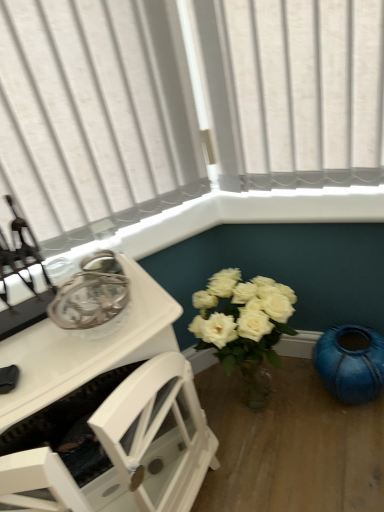
The image size is (384, 512). What are the coordinates of `teal glossy vase at lower right` in the screenshot? It's located at (351, 362).

Measure the distance between teal glossy vase at lower right and camera.

teal glossy vase at lower right and camera are 1.21 meters apart from each other.

What do you see at coordinates (351, 362) in the screenshot? I see `teal glossy vase at lower right` at bounding box center [351, 362].

What do you see at coordinates (87, 347) in the screenshot?
I see `white glossy table at upper left` at bounding box center [87, 347].

What are the coordinates of `white glossy table at upper left` in the screenshot? It's located at (87, 347).

Where is `teal glossy vase at lower right`? teal glossy vase at lower right is located at coordinates (351, 362).

Which is more to the right, teal glossy vase at lower right or white glossy table at upper left?

From the viewer's perspective, teal glossy vase at lower right appears more on the right side.

Relative to white glossy table at upper left, is teal glossy vase at lower right in front or behind?

teal glossy vase at lower right is behind white glossy table at upper left.

Does point (361, 354) appear closer or farther from the camera than point (145, 303)?

Point (361, 354).

From the image's perspective, between teal glossy vase at lower right and white glossy table at upper left, which one is located above?

white glossy table at upper left.

From a real-world perspective, is teal glossy vase at lower right above or below white glossy table at upper left?

teal glossy vase at lower right is below white glossy table at upper left.

Which object is thinner, teal glossy vase at lower right or white glossy table at upper left?

With smaller width is teal glossy vase at lower right.

Between teal glossy vase at lower right and white glossy table at upper left, which one has less height?

white glossy table at upper left is shorter.

Considering the relative sizes of teal glossy vase at lower right and white glossy table at upper left in the image provided, is teal glossy vase at lower right bigger than white glossy table at upper left?

Correct, teal glossy vase at lower right is larger in size than white glossy table at upper left.

Would you say teal glossy vase at lower right contains white glossy table at upper left?

Result: No, white glossy table at upper left is located outside of teal glossy vase at lower right.

Is teal glossy vase at lower right not near white glossy table at upper left?

They are positioned close to each other.

Does teal glossy vase at lower right turn towards white glossy table at upper left?

No.

How many degrees apart are the facing directions of teal glossy vase at lower right and white glossy table at upper left?

49.5 degrees.

Looking at this image, how far apart are teal glossy vase at lower right and white glossy table at upper left?

The distance of teal glossy vase at lower right from white glossy table at upper left is 25.91 inches.

In the image, there is a white glossy table at upper left. At what (x,y) coordinates should I click in order to perform the action: click on teal below it (from a real-world perspective). Please return your answer as a coordinate pair (x, y). The image size is (384, 512). Looking at the image, I should click on (351, 362).

Is white glossy table at upper left to the left or to the right of teal glossy vase at lower right in the image?

From the image, it's evident that white glossy table at upper left is to the left of teal glossy vase at lower right.

Which object is further away from the camera taking this photo, white glossy table at upper left or teal glossy vase at lower right?

teal glossy vase at lower right is further away from the camera.

Which is in front, point (31, 332) or point (350, 367)?

The point (31, 332) is closer.

From the image's perspective, does white glossy table at upper left appear lower than teal glossy vase at lower right?

Incorrect, from the image's perspective, white glossy table at upper left is higher than teal glossy vase at lower right.

From a real-world perspective, is white glossy table at upper left located higher than teal glossy vase at lower right?

Indeed, from a real-world perspective, white glossy table at upper left stands above teal glossy vase at lower right.

Does white glossy table at upper left have a lesser width compared to teal glossy vase at lower right?

No.

Can you confirm if white glossy table at upper left is shorter than teal glossy vase at lower right?

Indeed, white glossy table at upper left has a lesser height compared to teal glossy vase at lower right.

Considering the relative sizes of white glossy table at upper left and teal glossy vase at lower right in the image provided, is white glossy table at upper left bigger than teal glossy vase at lower right?

No, white glossy table at upper left is not bigger than teal glossy vase at lower right.

Would you say white glossy table at upper left contains teal glossy vase at lower right?

No.

Is white glossy table at upper left beside teal glossy vase at lower right?

No, white glossy table at upper left is not touching teal glossy vase at lower right.

Consider the image. Is white glossy table at upper left aimed at teal glossy vase at lower right?

No, white glossy table at upper left is not aimed at teal glossy vase at lower right.

How far apart are white glossy table at upper left and teal glossy vase at lower right?

65.82 centimeters.

In the image, there is a white glossy table at upper left. Identify the location of teal below it (from a real-world perspective). The image size is (384, 512). pos(351,362).

You are a GUI agent. You are given a task and a screenshot of the screen. Output one action in this format:
    pyautogui.click(x=<x>, y=<y>)
    Task: Click on the teal behind the white glossy table at upper left
    The width and height of the screenshot is (384, 512).
    Given the screenshot: What is the action you would take?
    pyautogui.click(x=351, y=362)

You are a GUI agent. You are given a task and a screenshot of the screen. Output one action in this format:
    pyautogui.click(x=<x>, y=<y>)
    Task: Click on the table above the teal glossy vase at lower right (from the image's perspective)
    
    Given the screenshot: What is the action you would take?
    pyautogui.click(x=87, y=347)